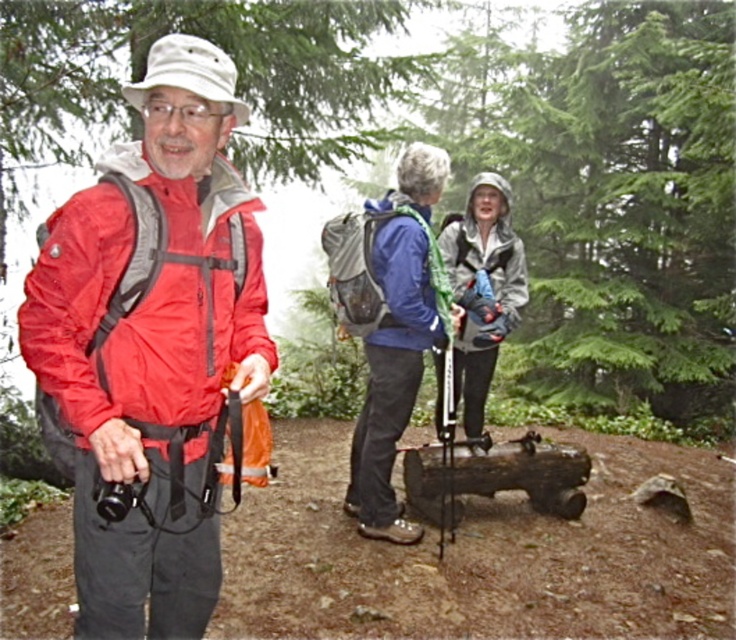
Question: Does green leafy tree at center appear under matte gray jacket at center?

Choices:
 (A) no
 (B) yes

Answer: (A)

Question: Which object is positioned closest to the blue matte jacket at center?

Choices:
 (A) matte nylon jacket at left
 (B) blue fabric jacket at center
 (C) green leafy tree at center
 (D) matte gray jacket at center

Answer: (B)

Question: Does green leafy tree at center have a smaller size compared to blue fabric jacket at center?

Choices:
 (A) yes
 (B) no

Answer: (B)

Question: Does matte nylon jacket at left have a greater width compared to matte gray jacket at center?

Choices:
 (A) no
 (B) yes

Answer: (A)

Question: Which object is positioned closest to the matte gray jacket at center?

Choices:
 (A) matte nylon jacket at left
 (B) blue matte jacket at center
 (C) blue fabric jacket at center

Answer: (C)

Question: Which object appears farthest from the camera in this image?

Choices:
 (A) matte gray jacket at center
 (B) blue matte jacket at center
 (C) blue fabric jacket at center

Answer: (A)